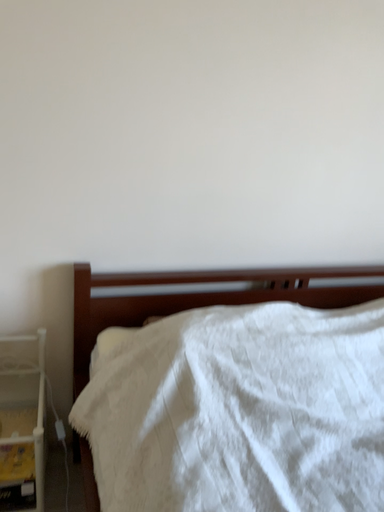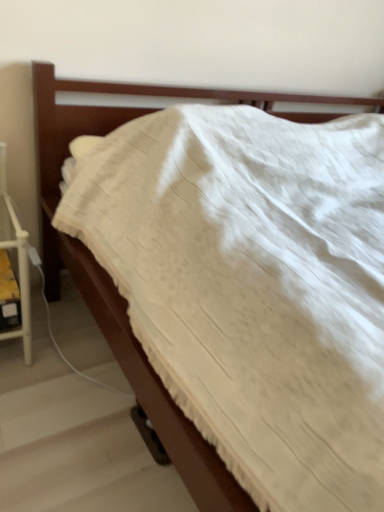
Question: How did the camera likely rotate when shooting the video?

Choices:
 (A) rotated downward
 (B) rotated upward

Answer: (A)